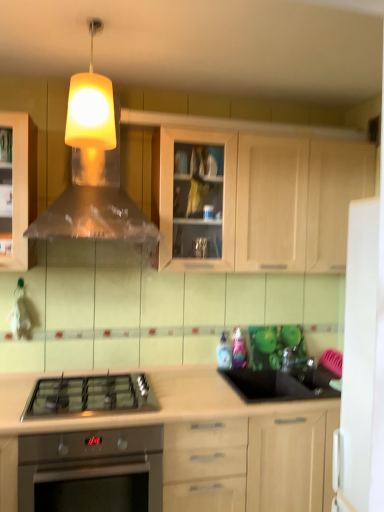
You are a GUI agent. You are given a task and a screenshot of the screen. Output one action in this format:
    pyautogui.click(x=<x>, y=<y>)
    Task: Click on the blank space above satin black gas stove at center (from a real-world perspective)
    The image size is (384, 512).
    Given the screenshot: What is the action you would take?
    pyautogui.click(x=98, y=381)